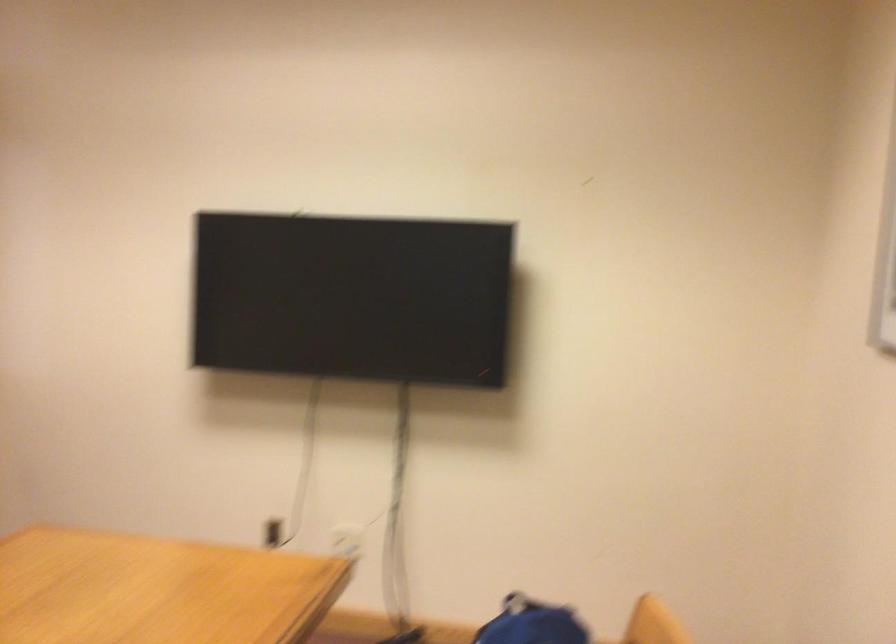
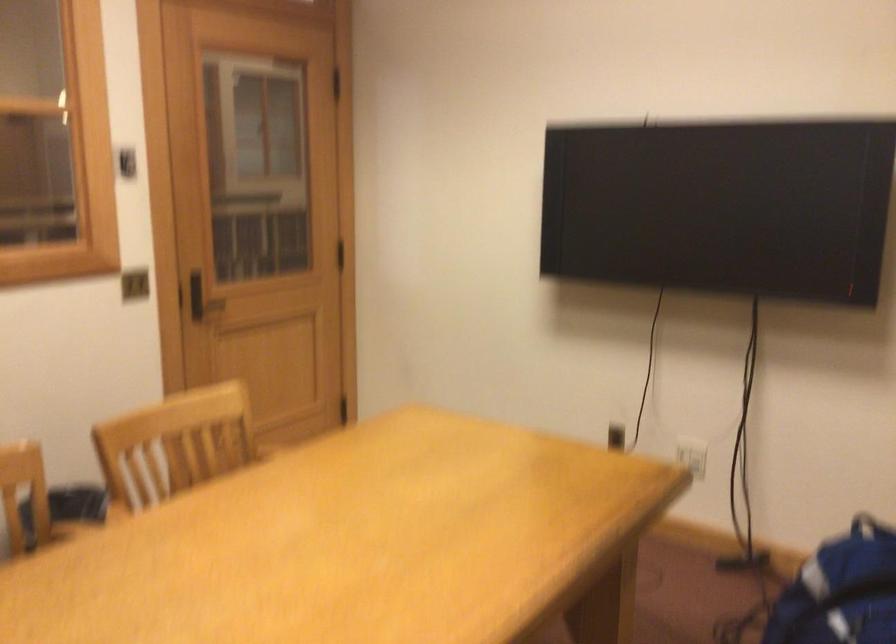
The point at (354, 540) is marked in the first image. Where is the corresponding point in the second image?

(692, 455)